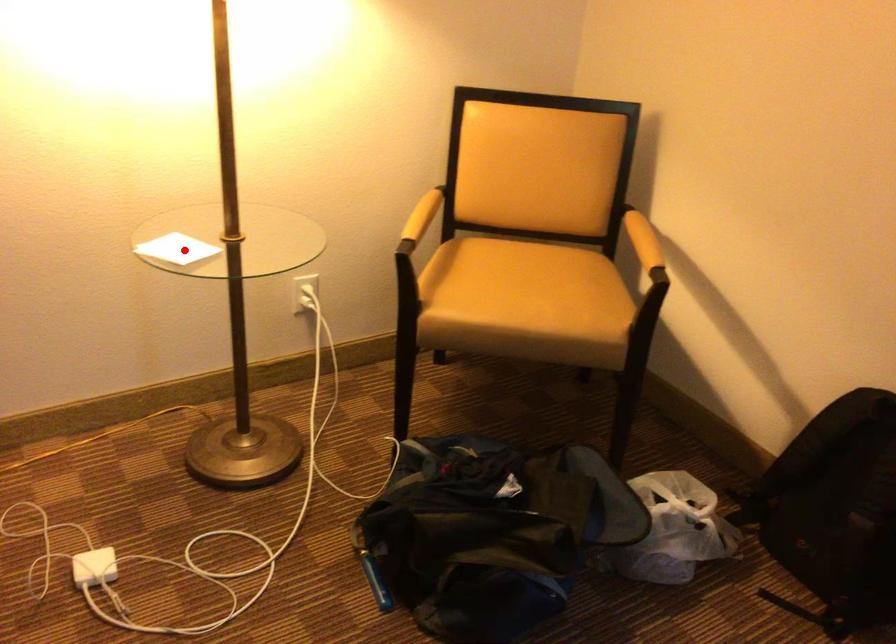
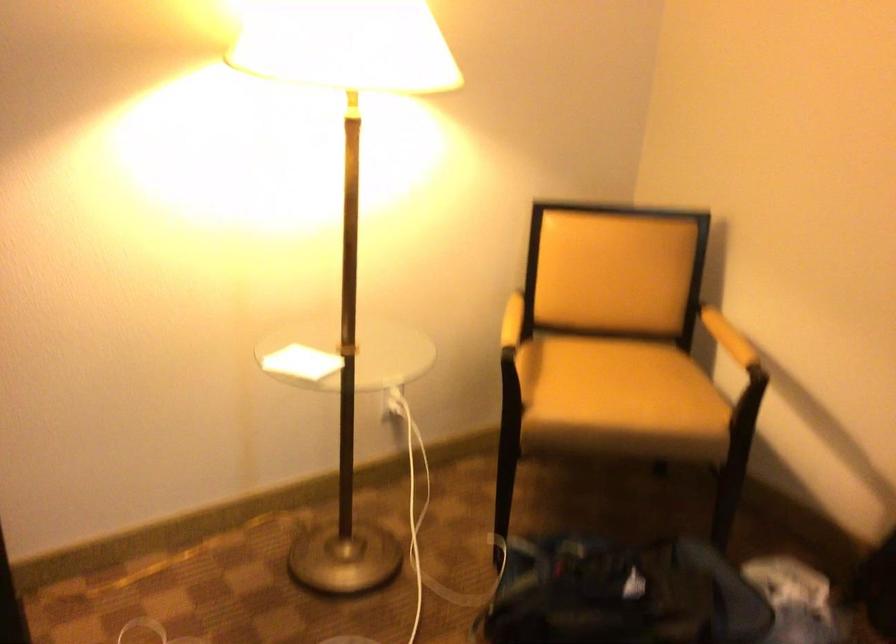
Find the pixel in the second image that matches the highlighted location in the first image.

(300, 363)